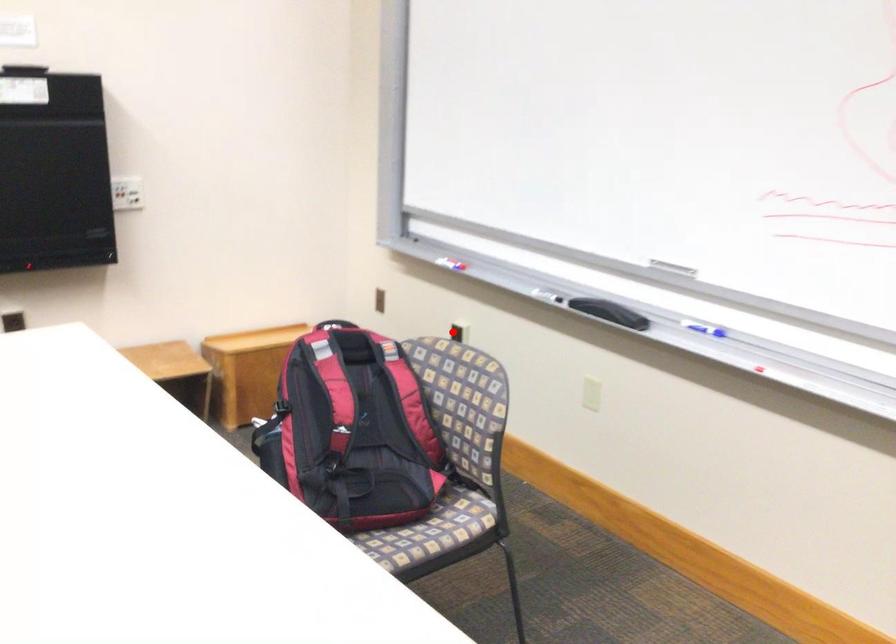
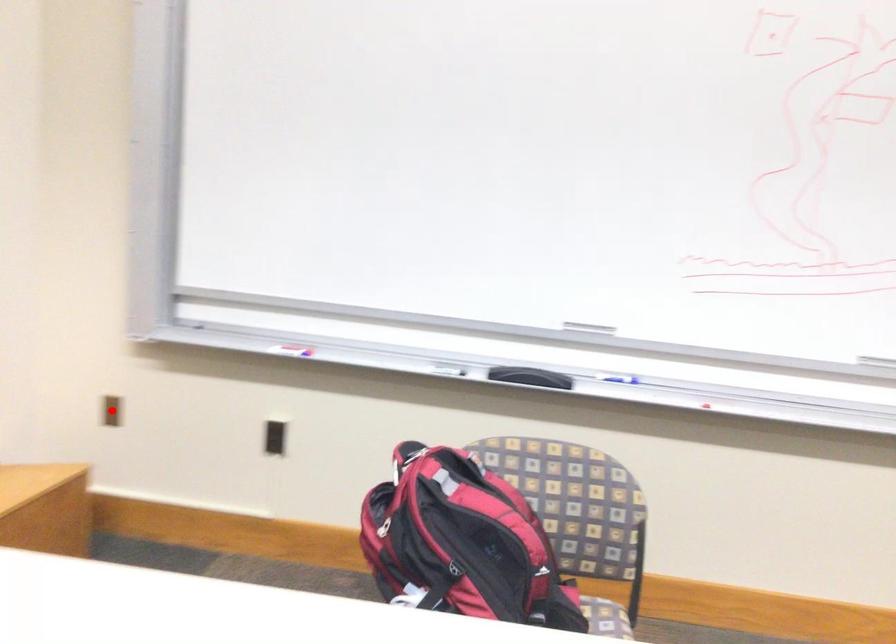
I am providing you with two images of the same scene from different viewpoints. A red point is marked on the first image and another point is marked on the second image. Is the marked point in image1 the same physical position as the marked point in image2?

No